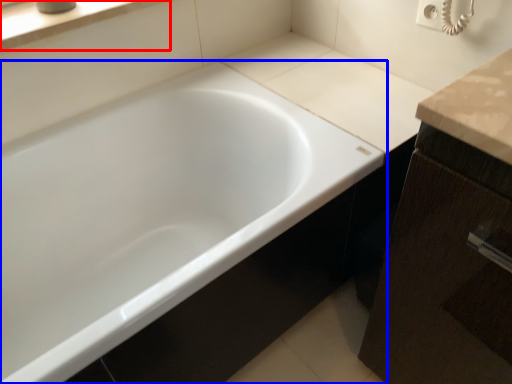
Question: Which of the following is the closest to the observer, window sill (highlighted by a red box) or bathtub (highlighted by a blue box)?

Choices:
 (A) window sill
 (B) bathtub

Answer: (B)